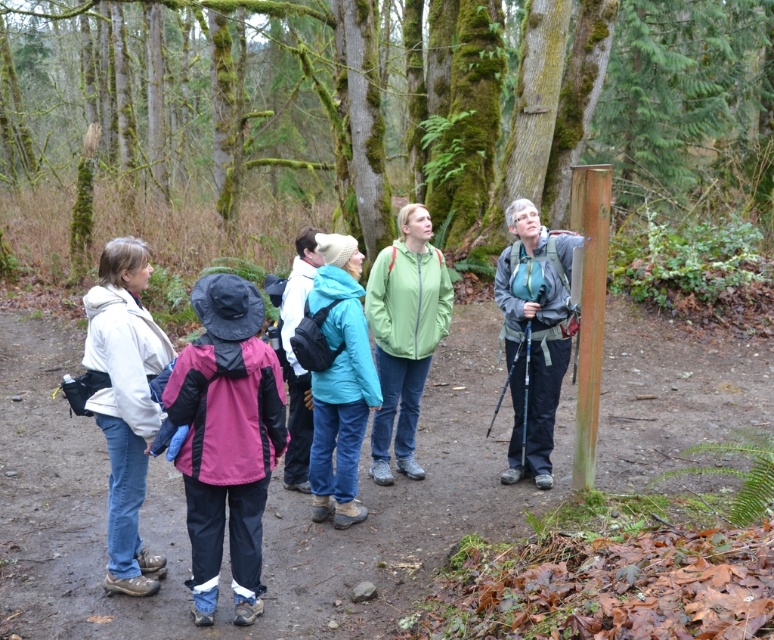
You are a hiker trying to determine if your backpack can fit between the smooth wooden post at center and the teal matte jacket at center. The backpack is 1 foot wide. Can it fit?

The smooth wooden post at center might be wider than the teal matte jacket at center, so the space between them may not be sufficient for a 1 foot wide backpack. It is uncertain if it will fit without knowing the exact width difference.

You are standing in the forest clearing and want to walk towards the two points marked in the image. Which point, point (7, 172) or point (317, 240), is closer to you?

Point (7, 172) is closer to you because it is further to the viewer than point (317, 240).

You are a hiker trying to identify the largest jacket among the group. You see a green matte jacket at center and a teal matte jacket at center. Which jacket is larger?

The green matte jacket at center is bigger than the teal matte jacket at center, so the green matte jacket at center is the larger one.